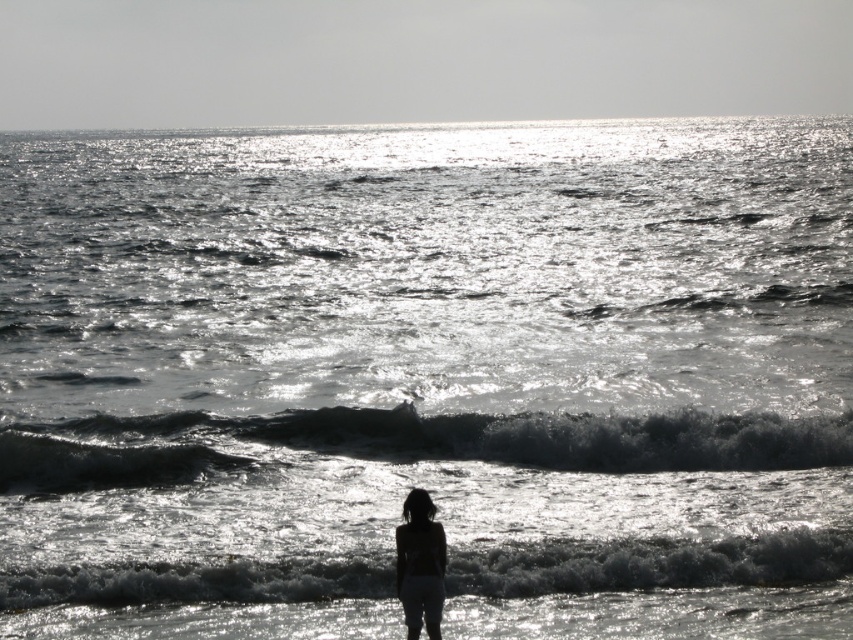
Question: Does white frothy wave at lower center have a smaller size compared to silhouette fabric at center?

Choices:
 (A) yes
 (B) no

Answer: (B)

Question: Which object is farther from the camera taking this photo?

Choices:
 (A) white frothy wave at lower center
 (B) silhouette fabric at center
 (C) shiny dark water at lower center

Answer: (C)

Question: Is white frothy wave at lower center to the left of silhouette fabric at center from the viewer's perspective?

Choices:
 (A) yes
 (B) no

Answer: (B)

Question: Among these points, which one is farthest from the camera?

Choices:
 (A) (250, 588)
 (B) (426, 630)
 (C) (735, 451)

Answer: (C)

Question: Based on their relative distances, which object is nearer to the white frothy wave at lower center?

Choices:
 (A) silhouette fabric at center
 (B) shiny dark water at lower center

Answer: (A)

Question: Is shiny dark water at lower center positioned behind silhouette fabric at center?

Choices:
 (A) no
 (B) yes

Answer: (B)